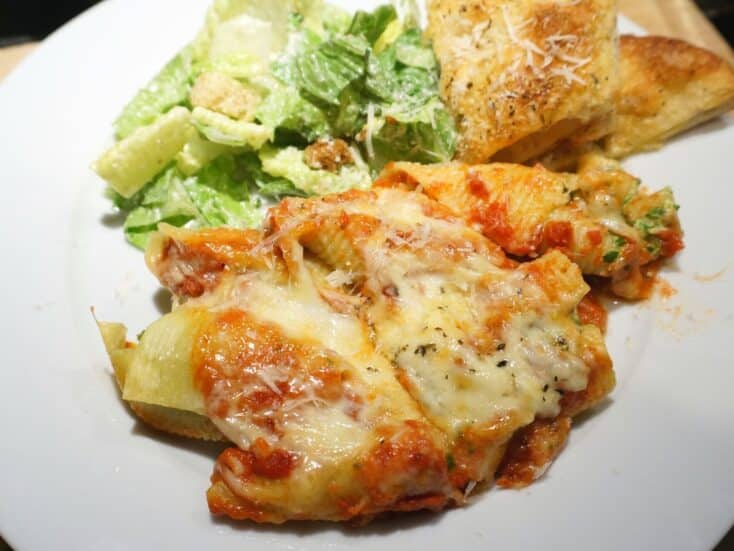
This screenshot has height=551, width=734. Find the location of `the left brown area of table`. the left brown area of table is located at coordinates (12, 60).